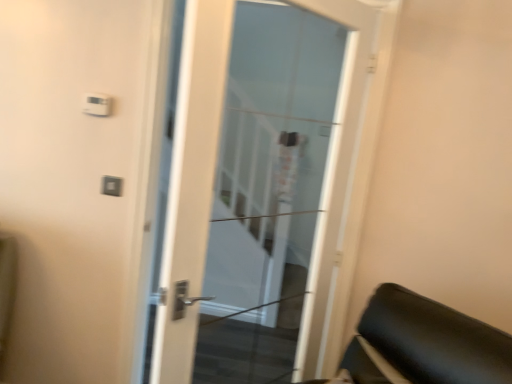
Question: Does matte plastic light switch at upper left have a lesser height compared to white glass door at center?

Choices:
 (A) no
 (B) yes

Answer: (B)

Question: Is matte plastic light switch at upper left thinner than white glass door at center?

Choices:
 (A) no
 (B) yes

Answer: (B)

Question: Does matte plastic light switch at upper left have a larger size compared to white glass door at center?

Choices:
 (A) yes
 (B) no

Answer: (B)

Question: From the image's perspective, is matte plastic light switch at upper left located beneath white glass door at center?

Choices:
 (A) yes
 (B) no

Answer: (B)

Question: Can you confirm if matte plastic light switch at upper left is wider than white glass door at center?

Choices:
 (A) no
 (B) yes

Answer: (A)

Question: Is matte plastic light switch at upper left not within white glass door at center?

Choices:
 (A) no
 (B) yes

Answer: (B)

Question: Is white glass door at center not close to matte plastic light switch at upper left?

Choices:
 (A) yes
 (B) no

Answer: (A)

Question: From a real-world perspective, is white glass door at center over matte plastic light switch at upper left?

Choices:
 (A) yes
 (B) no

Answer: (A)

Question: Does white glass door at center have a larger size compared to matte plastic light switch at upper left?

Choices:
 (A) no
 (B) yes

Answer: (B)

Question: Can you see white glass door at center touching matte plastic light switch at upper left?

Choices:
 (A) no
 (B) yes

Answer: (A)

Question: Is matte plastic light switch at upper left located within white glass door at center?

Choices:
 (A) yes
 (B) no

Answer: (B)

Question: Is white glass door at center positioned behind matte plastic light switch at upper left?

Choices:
 (A) no
 (B) yes

Answer: (A)

Question: From a real-world perspective, is white glass door at center above or below matte plastic light switch at upper left?

Choices:
 (A) below
 (B) above

Answer: (B)